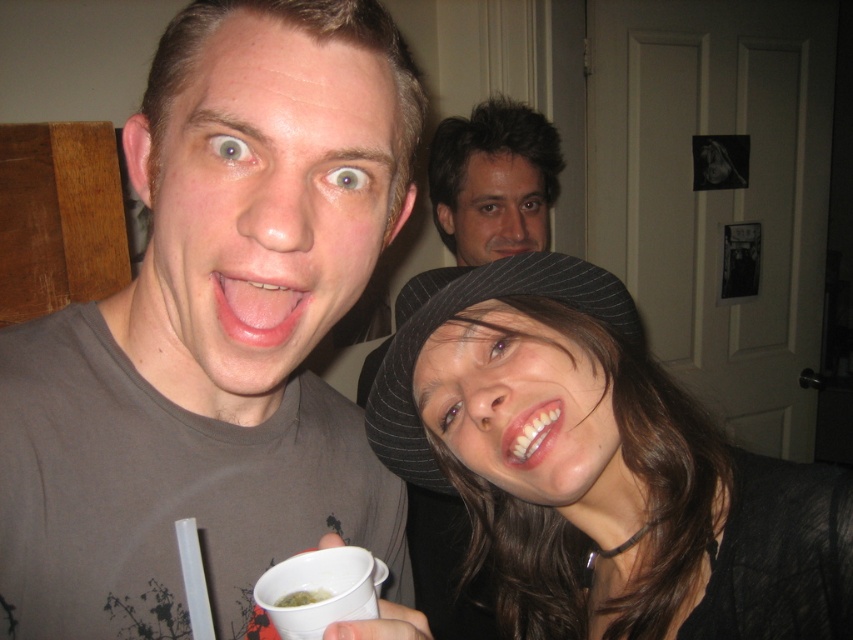
Question: Is green liquid at cup right to the left of white glossy teeth at center from the viewer's perspective?

Choices:
 (A) no
 (B) yes

Answer: (B)

Question: Considering the relative positions of matte gray t-shirt at center and white glossy teeth at center in the image provided, where is matte gray t-shirt at center located with respect to white glossy teeth at center?

Choices:
 (A) right
 (B) left

Answer: (B)

Question: Does green liquid at cup right appear under white glossy teeth at center?

Choices:
 (A) no
 (B) yes

Answer: (B)

Question: Which of these objects is positioned closest to the white glossy teeth at center?

Choices:
 (A) green liquid at cup center
 (B) pink glossy tongue at center
 (C) matte gray t-shirt at center

Answer: (A)

Question: Which of the following is the farthest from the observer?

Choices:
 (A) white glossy teeth at center
 (B) matte gray t-shirt at center

Answer: (A)

Question: Which point is farther to the camera?

Choices:
 (A) (392, 426)
 (B) (294, 632)
 (C) (310, 600)
 (D) (267, 344)

Answer: (A)